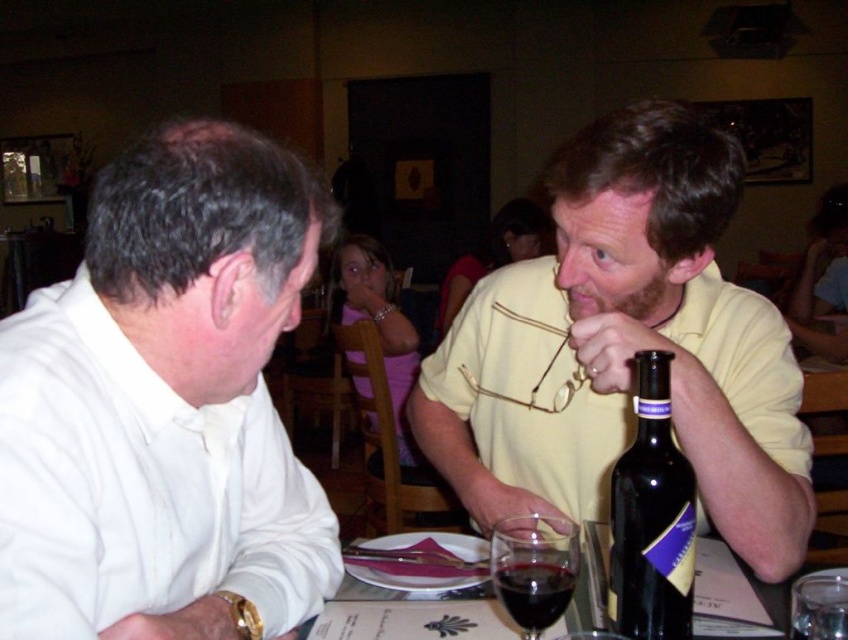
Question: Which point is closer to the camera?

Choices:
 (A) (633, 204)
 (B) (553, 576)
 (C) (344, 612)
 (D) (154, 456)

Answer: (B)

Question: Which object appears farthest from the camera in this image?

Choices:
 (A) transparent glass at lower center
 (B) white matte shirt at left
 (C) translucent glass wine at center
 (D) dark glass wine at lower center

Answer: (C)

Question: Which point appears closest to the camera in this image?

Choices:
 (A) (525, 630)
 (B) (512, 529)
 (C) (562, 177)
 (D) (160, 438)

Answer: (A)

Question: Does dark glass bottle at right have a larger size compared to translucent glass wine at center?

Choices:
 (A) no
 (B) yes

Answer: (A)

Question: Is white matte shirt at left to the right of yellow matte shirt at right from the viewer's perspective?

Choices:
 (A) yes
 (B) no

Answer: (B)

Question: Observing the image, what is the correct spatial positioning of transparent glass at lower center in reference to dark glass wine at lower center?

Choices:
 (A) below
 (B) above

Answer: (B)